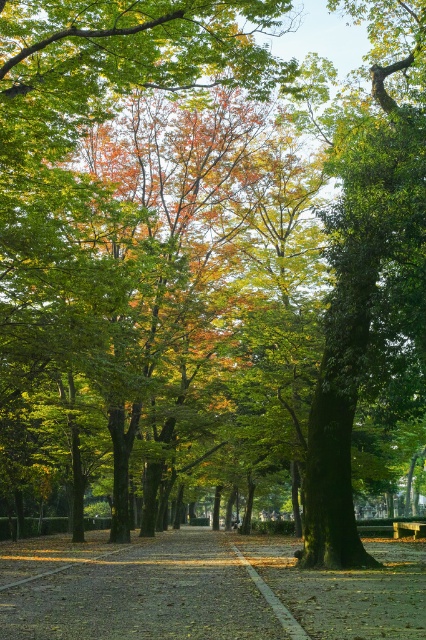
From the picture: You are a park visitor who wants to take a photo of the green mossy tree at center and the wooden park bench at center from a distance. Which object will appear larger in the photo?

The green mossy tree at center will appear larger in the photo because it is much taller than the wooden park bench at center.

You are standing at the start of the dirt path at center. Which direction should you walk to reach the point marked by coordinates point (141, 588)?

The point marked by coordinates point (141, 588) is located at the dirt path at center, so you are already at that point.

You are planning to take a nap in the park. You see the green mossy tree at center and the wooden park bench at center. Which object would you choose to lie down on for a more comfortable rest, and why?

The wooden park bench at center is smaller than the green mossy tree at center, so the wooden park bench at center would provide a more comfortable surface for lying down as it is designed for seating, whereas the tree might have uneven mossy surfaces that could be less comfortable.